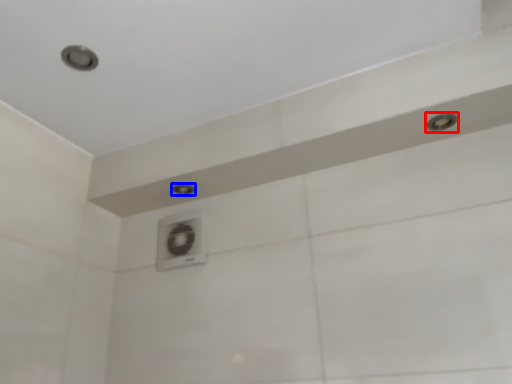
Question: Which of the following is the closest to the observer, shower (highlighted by a red box) or shower (highlighted by a blue box)?

Choices:
 (A) shower
 (B) shower

Answer: (A)